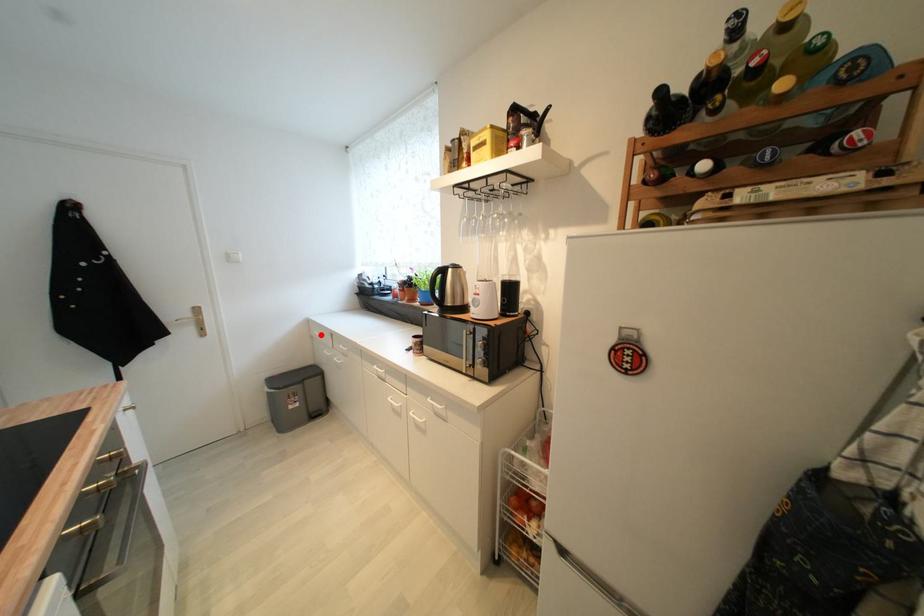
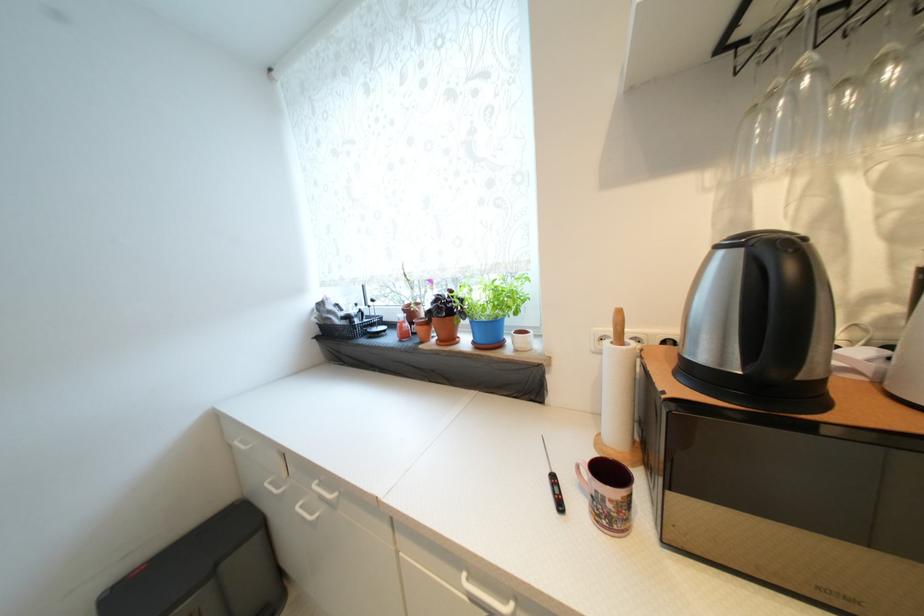
Locate, in the second image, the point that corresponds to the highlighted location in the first image.

(242, 445)